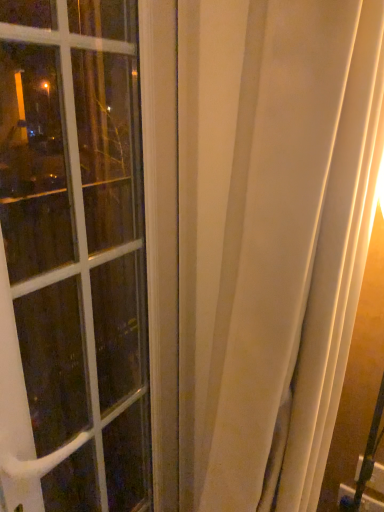
Question: From a real-world perspective, is white glass window at left above or below white sheer curtain at center?

Choices:
 (A) below
 (B) above

Answer: (B)

Question: Does point (110, 283) appear closer or farther from the camera than point (291, 242)?

Choices:
 (A) closer
 (B) farther

Answer: (B)

Question: Is white glass window at left situated inside white sheer curtain at center or outside?

Choices:
 (A) inside
 (B) outside

Answer: (B)

Question: In the image, is white sheer curtain at center positioned in front of or behind white glass window at left?

Choices:
 (A) front
 (B) behind

Answer: (A)

Question: Considering the positions of white sheer curtain at center and white glass window at left in the image, is white sheer curtain at center taller or shorter than white glass window at left?

Choices:
 (A) short
 (B) tall

Answer: (B)

Question: Considering the relative positions of white sheer curtain at center and white glass window at left in the image provided, is white sheer curtain at center to the left or to the right of white glass window at left?

Choices:
 (A) left
 (B) right

Answer: (B)

Question: From a real-world perspective, is white sheer curtain at center above or below white glass window at left?

Choices:
 (A) above
 (B) below

Answer: (B)